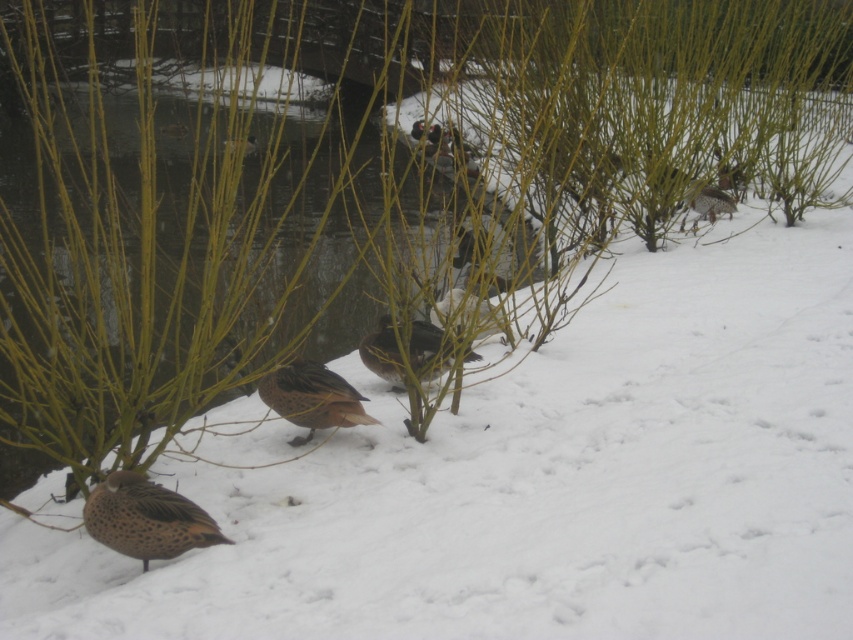
You are standing in the winter scene and want to reach the point marked as point (154, 525). If your walking speed is 3 feet per second, how many seconds will it take you to reach that point?

The point (154, 525) is 14.99 feet away from the viewer. At a speed of 3 feet per second, it would take approximately 14.99 divided by 3, which is about 4.997 seconds, so roughly 5 seconds to reach the point.

You are a birdwatcher observing the ducks in the winter scene. You notice both brown speckled feathers at center and brown speckled duck at center. Which object is positioned lower in the image?

The brown speckled feathers at center are located below the brown speckled duck at center, so the brown speckled feathers at center is positioned lower in the image.

You are a photographer trying to capture the speckled brown duck at lower left and the brown speckled feathers at center in the same frame. Given their sizes, which one would you need to zoom in more on to get a clear closeup?

The speckled brown duck at lower left is smaller in size compared to the brown speckled feathers at center, so you would need to zoom in more on the speckled brown duck at lower left to capture it clearly in the frame.